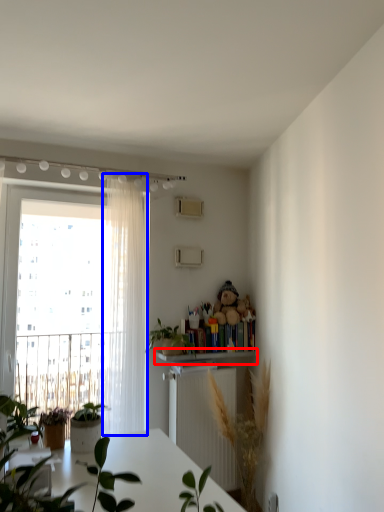
Question: Which of the following is the closest to the observer, shelf (highlighted by a red box) or curtain (highlighted by a blue box)?

Choices:
 (A) shelf
 (B) curtain

Answer: (B)